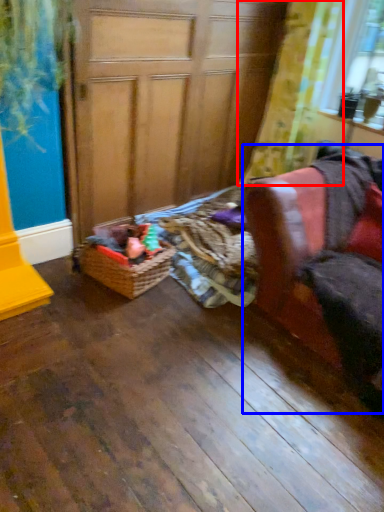
Question: Which object is closer to the camera taking this photo, curtain (highlighted by a red box) or armchair (highlighted by a blue box)?

Choices:
 (A) curtain
 (B) armchair

Answer: (B)